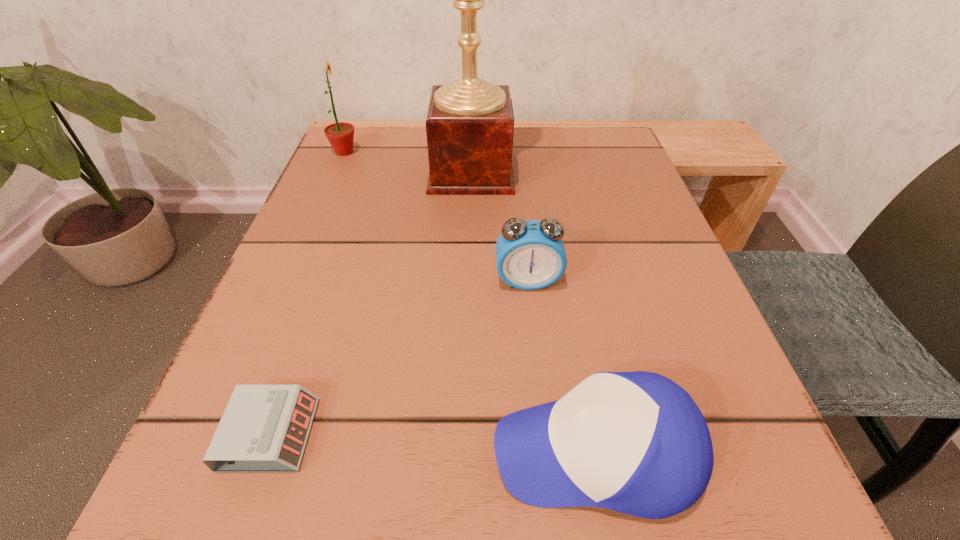
Image resolution: width=960 pixels, height=540 pixels. I want to click on the tallest object, so click(x=470, y=122).

The width and height of the screenshot is (960, 540). I want to click on sunflower, so click(340, 135).

The height and width of the screenshot is (540, 960). I want to click on the right alarm clock, so click(x=530, y=255).

Identify the location of the third farthest object. (530, 255).

At what (x,y) coordinates should I click in order to perform the action: click on baseball cap. Please return your answer as a coordinate pair (x, y). Looking at the image, I should click on (635, 442).

The width and height of the screenshot is (960, 540). I want to click on the shorter alarm clock, so click(264, 429).

The height and width of the screenshot is (540, 960). Identify the location of the nearer alarm clock. (264, 429).

Identify the location of vacant region located 0.140m on the plaque of the tallest object. Image resolution: width=960 pixels, height=540 pixels. (583, 171).

Locate an element on the screen. Image resolution: width=960 pixels, height=540 pixels. free spot located 0.280m on the face of the fourth shortest object is located at coordinates (491, 152).

At what (x,y) coordinates should I click in order to perform the action: click on vacant space located on the face of the third tallest object. Please return your answer as a coordinate pair (x, y). This screenshot has height=540, width=960. Looking at the image, I should click on (536, 354).